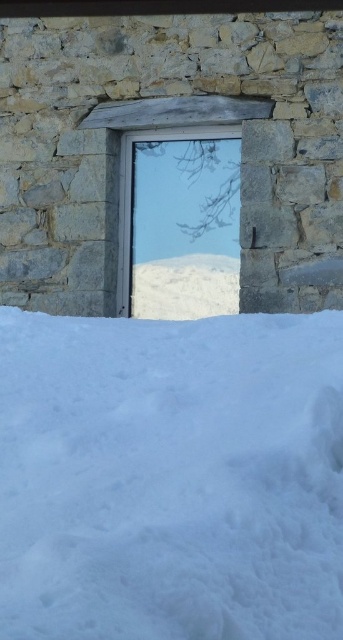
Question: Can you confirm if white fluffy snow at lower center is positioned to the right of transparent glass window at center?

Choices:
 (A) no
 (B) yes

Answer: (A)

Question: Does white fluffy snow at lower center have a lesser width compared to transparent glass window at center?

Choices:
 (A) yes
 (B) no

Answer: (B)

Question: Which of the following is the closest to the observer?

Choices:
 (A) white fluffy snow at lower center
 (B) transparent glass window at center

Answer: (A)

Question: Does white fluffy snow at lower center have a smaller size compared to transparent glass window at center?

Choices:
 (A) yes
 (B) no

Answer: (B)